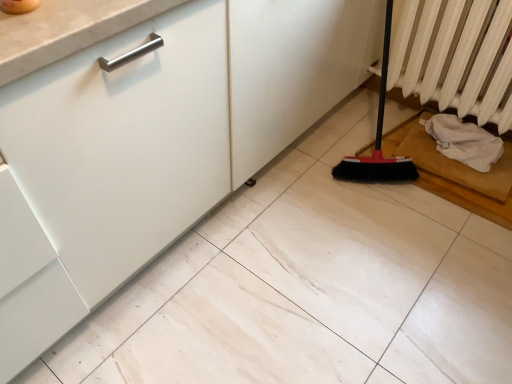
Locate an element on the screen. This screenshot has height=384, width=512. white fabric at lower right is located at coordinates (464, 141).

Describe the element at coordinates (464, 141) in the screenshot. I see `white fabric at lower right` at that location.

Find the location of a particular element. white textured radiator at right is located at coordinates (456, 57).

Describe the element at coordinates (456, 57) in the screenshot. I see `white textured radiator at right` at that location.

Find the location of a particular element. white fabric at lower right is located at coordinates (464, 141).

Is white fabric at lower right at the left side of white textured radiator at right?

Incorrect, white fabric at lower right is not on the left side of white textured radiator at right.

Looking at this image, is white fabric at lower right positioned in front of white textured radiator at right?

No, it is behind white textured radiator at right.

Which is farther from the camera, (450, 129) or (426, 0)?

Positioned behind is point (450, 129).

From the image's perspective, relative to white textured radiator at right, is white fabric at lower right above or below?

Based on their image positions, white fabric at lower right is located beneath white textured radiator at right.

From a real-world perspective, between white fabric at lower right and white textured radiator at right, who is vertically higher?

In real-world perspective, white textured radiator at right is above.

Considering the relative sizes of white fabric at lower right and white textured radiator at right in the image provided, is white fabric at lower right wider than white textured radiator at right?

Indeed, white fabric at lower right has a greater width compared to white textured radiator at right.

Is white fabric at lower right taller or shorter than white textured radiator at right?

In the image, white fabric at lower right appears to be shorter than white textured radiator at right.

Considering the sizes of objects white fabric at lower right and white textured radiator at right in the image provided, who is smaller, white fabric at lower right or white textured radiator at right?

Smaller between the two is white fabric at lower right.

Is white fabric at lower right situated inside white textured radiator at right or outside?

white fabric at lower right is not inside white textured radiator at right, it's outside.

Based on the photo, can you see white fabric at lower right touching white textured radiator at right?

No, white fabric at lower right is not making contact with white textured radiator at right.

Is white fabric at lower right aimed at white textured radiator at right?

→ No.

How many degrees apart are the facing directions of white fabric at lower right and white textured radiator at right?

The facing directions of white fabric at lower right and white textured radiator at right are 0.678 degrees apart.

The image size is (512, 384). I want to click on material behind the white textured radiator at right, so click(x=464, y=141).

Is white textured radiator at right to the right of white fabric at lower right from the viewer's perspective?

No.

Which object is closer to the camera, white textured radiator at right or white fabric at lower right?

white textured radiator at right is closer to the camera.

Which is behind, point (470, 70) or point (436, 140)?

The point (436, 140) is farther from the camera.

From the image's perspective, relative to white fabric at lower right, is white textured radiator at right above or below?

white textured radiator at right is above white fabric at lower right.

From a real-world perspective, is white textured radiator at right positioned above or below white fabric at lower right?

white textured radiator at right is above white fabric at lower right.

Is white textured radiator at right wider than white fabric at lower right?

In fact, white textured radiator at right might be narrower than white fabric at lower right.

Is white textured radiator at right taller than white fabric at lower right?

Indeed, white textured radiator at right has a greater height compared to white fabric at lower right.

Between white textured radiator at right and white fabric at lower right, which one has larger size?

white textured radiator at right.

Is white textured radiator at right inside or outside of white fabric at lower right?

white textured radiator at right is located beyond the bounds of white fabric at lower right.

Are white textured radiator at right and white fabric at lower right located far from each other?

white textured radiator at right is actually quite close to white fabric at lower right.

Could you tell me if white textured radiator at right is turned towards white fabric at lower right?

No, white textured radiator at right is not facing towards white fabric at lower right.

How different are the orientations of white textured radiator at right and white fabric at lower right in degrees?

They differ by 0.678 degrees in their facing directions.

How far apart are white textured radiator at right and white fabric at lower right?

white textured radiator at right and white fabric at lower right are 21.17 centimeters apart from each other.

At what (x,y) coordinates should I click in order to perform the action: click on radiator above the white fabric at lower right (from a real-world perspective). Please return your answer as a coordinate pair (x, y). Looking at the image, I should click on (456, 57).

What are the coordinates of `material that appears on the right of white textured radiator at right` in the screenshot? It's located at (464, 141).

Find the location of `material below the white textured radiator at right (from the image's perspective)`. material below the white textured radiator at right (from the image's perspective) is located at coordinates (464, 141).